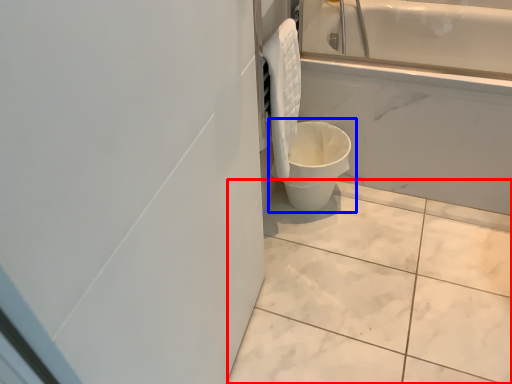
Question: Which of the following is the closest to the observer, ceramic tile (highlighted by a red box) or toilet (highlighted by a blue box)?

Choices:
 (A) ceramic tile
 (B) toilet

Answer: (A)